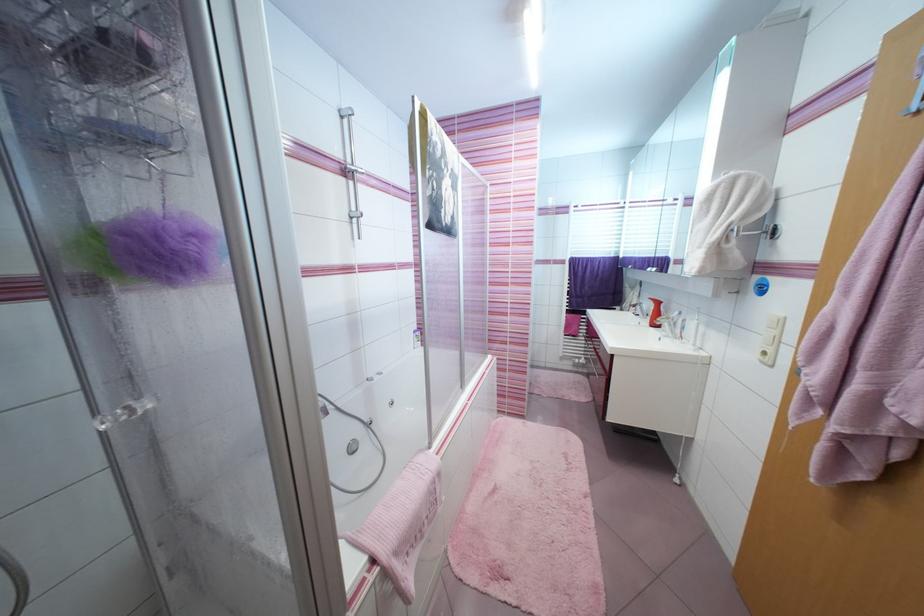
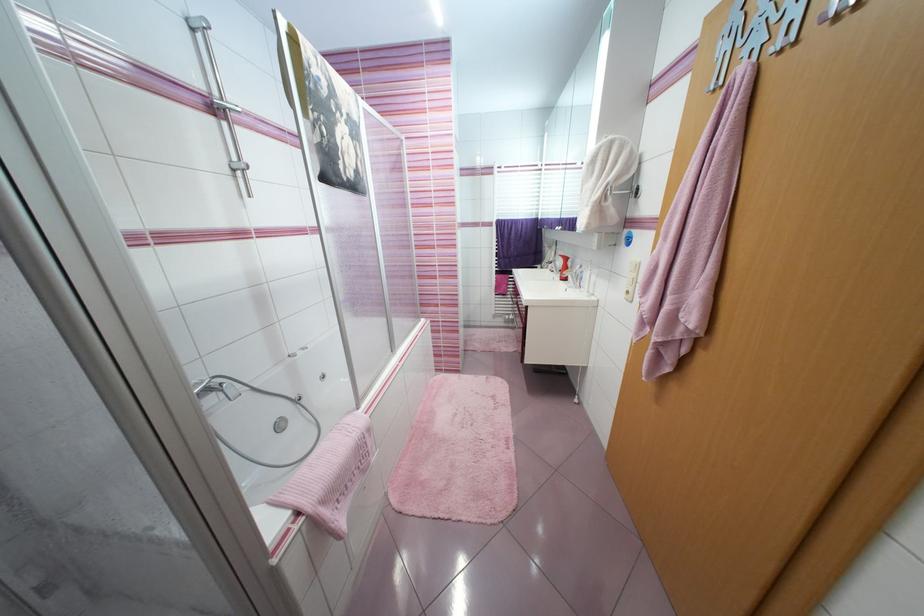
Find the pixel in the second image that matches [347,119] in the first image.

(198, 31)